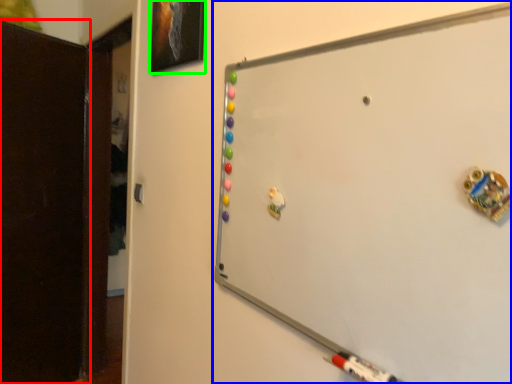
Question: Estimate the real-world distances between objects in this image. Which object is closer to door (highlighted by a red box), whiteboard (highlighted by a blue box) or picture frame (highlighted by a green box)?

Choices:
 (A) whiteboard
 (B) picture frame

Answer: (B)